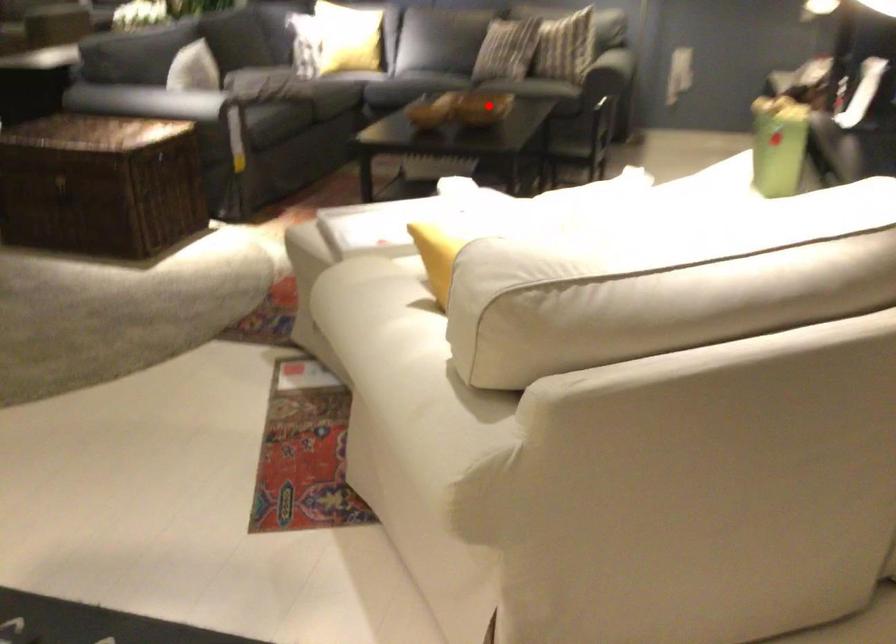
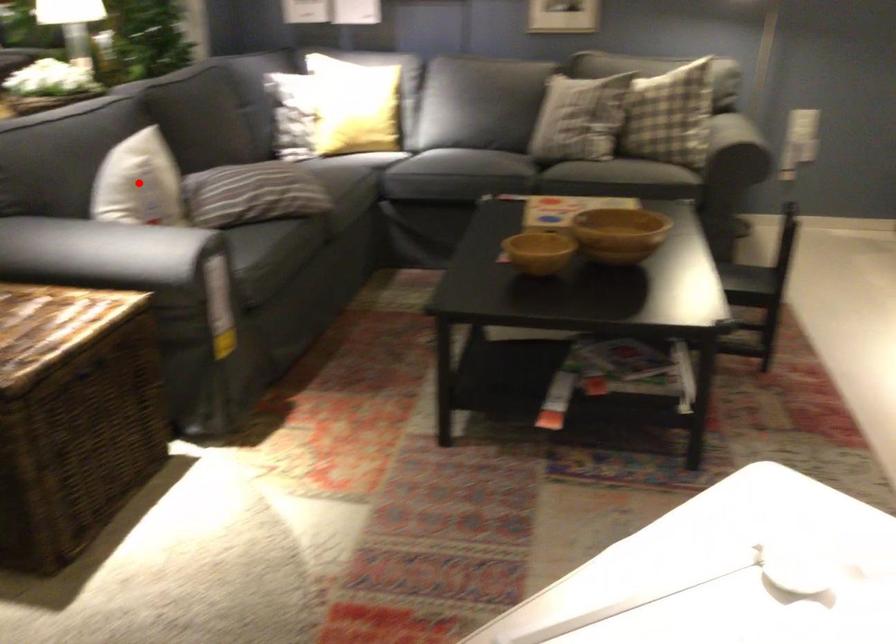
I am providing you with two images of the same scene from different viewpoints. A red point is marked on the first image and another point is marked on the second image. Does the point marked in image1 correspond to the same location as the one in image2?

No